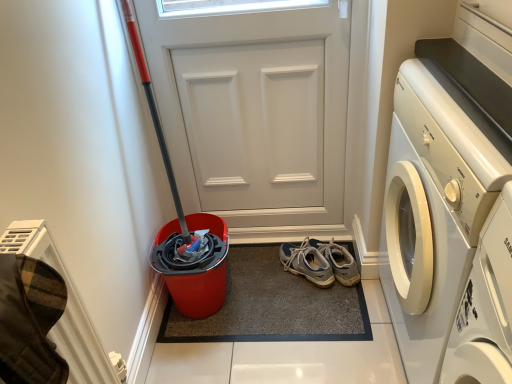
Where is `free point behind light blue suede sneakers at center`? The image size is (512, 384). free point behind light blue suede sneakers at center is located at coordinates tap(297, 241).